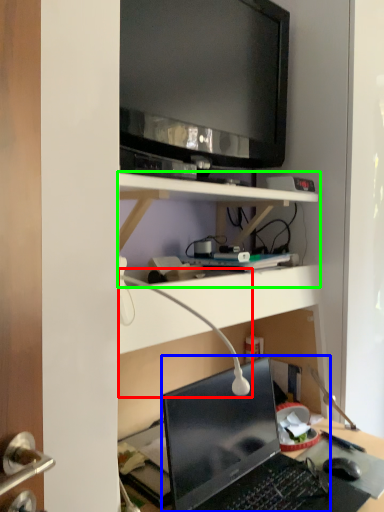
Question: Which is nearer to the table lamp (highlighted by a red box)? laptop (highlighted by a blue box) or shelf (highlighted by a green box).

Choices:
 (A) laptop
 (B) shelf

Answer: (A)